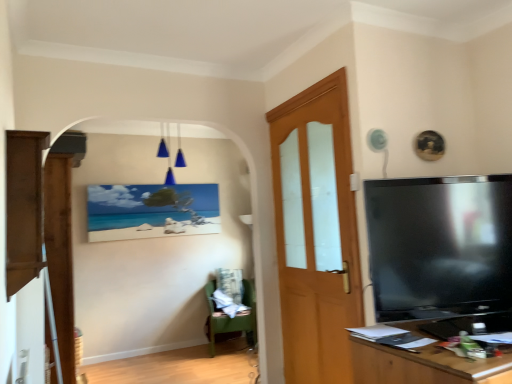
Question: From a real-world perspective, is matte canvas painting at center beneath blue glass light fixture at upper center?

Choices:
 (A) yes
 (B) no

Answer: (A)

Question: Is matte canvas painting at center touching blue glass light fixture at upper center?

Choices:
 (A) no
 (B) yes

Answer: (A)

Question: Considering the relative sizes of matte canvas painting at center and blue glass light fixture at upper center in the image provided, is matte canvas painting at center smaller than blue glass light fixture at upper center?

Choices:
 (A) no
 (B) yes

Answer: (B)

Question: From the image's perspective, does matte canvas painting at center appear lower than blue glass light fixture at upper center?

Choices:
 (A) yes
 (B) no

Answer: (A)

Question: Considering the relative positions of matte canvas painting at center and blue glass light fixture at upper center in the image provided, is matte canvas painting at center to the right of blue glass light fixture at upper center from the viewer's perspective?

Choices:
 (A) yes
 (B) no

Answer: (B)

Question: From the image's perspective, relative to brown wood cabinet at left, is blue glass light fixture at upper center above or below?

Choices:
 (A) above
 (B) below

Answer: (A)

Question: Considering their positions, is blue glass light fixture at upper center located in front of or behind brown wood cabinet at left?

Choices:
 (A) front
 (B) behind

Answer: (B)

Question: From a real-world perspective, is blue glass light fixture at upper center physically located above or below brown wood cabinet at left?

Choices:
 (A) below
 (B) above

Answer: (B)

Question: Is blue glass light fixture at upper center taller or shorter than brown wood cabinet at left?

Choices:
 (A) tall
 (B) short

Answer: (B)

Question: Relative to black glossy tv at right, is wooden door at center in front or behind?

Choices:
 (A) front
 (B) behind

Answer: (B)

Question: Is wooden door at center to the left or to the right of black glossy tv at right in the image?

Choices:
 (A) right
 (B) left

Answer: (B)

Question: From the image's perspective, relative to black glossy tv at right, is wooden door at center above or below?

Choices:
 (A) below
 (B) above

Answer: (A)

Question: From a real-world perspective, is wooden door at center physically located above or below black glossy tv at right?

Choices:
 (A) above
 (B) below

Answer: (B)

Question: Is wooden desk at right in front of or behind matte canvas painting at center in the image?

Choices:
 (A) front
 (B) behind

Answer: (A)

Question: From a real-world perspective, is wooden desk at right physically located above or below matte canvas painting at center?

Choices:
 (A) above
 (B) below

Answer: (B)